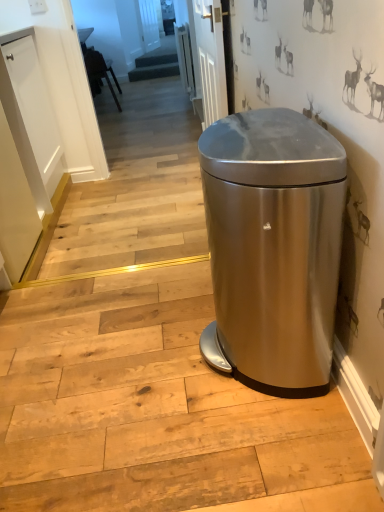
The width and height of the screenshot is (384, 512). In order to click on satin silver trash can at center in this screenshot , I will do [273, 247].

This screenshot has width=384, height=512. What do you see at coordinates (273, 247) in the screenshot?
I see `satin silver trash can at center` at bounding box center [273, 247].

Where is `satin silver trash can at center`? This screenshot has width=384, height=512. satin silver trash can at center is located at coordinates (273, 247).